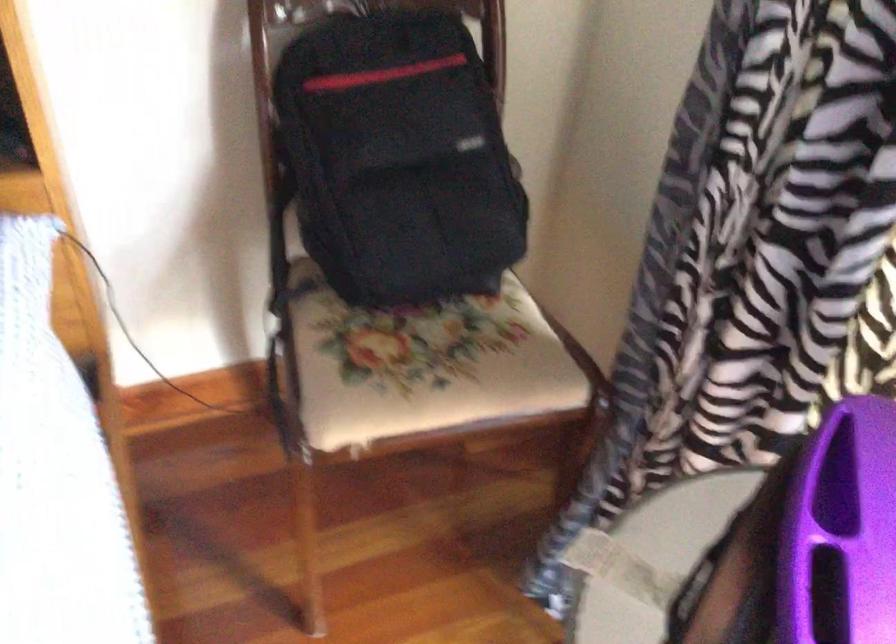
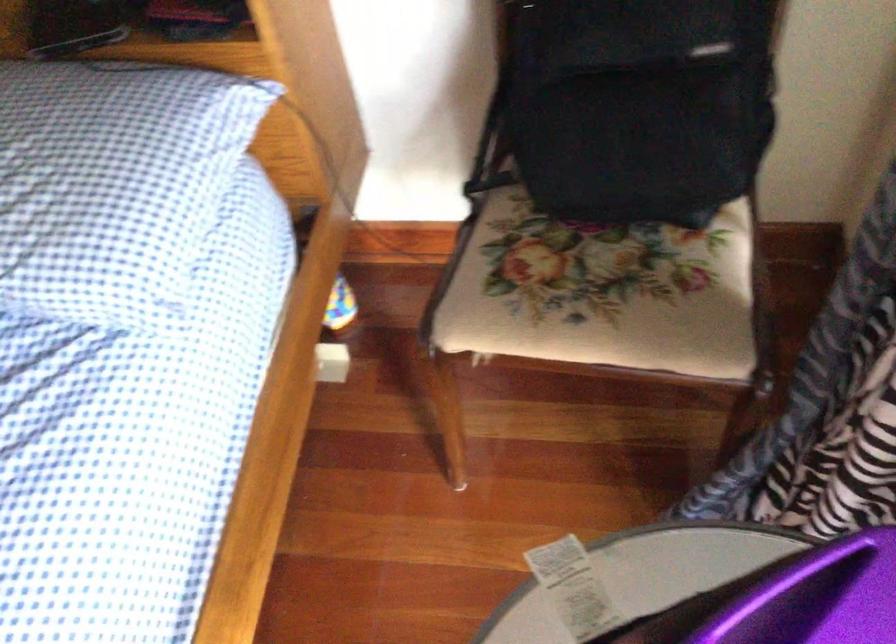
In the second image, find the point that corresponds to (431,192) in the first image.

(639, 104)